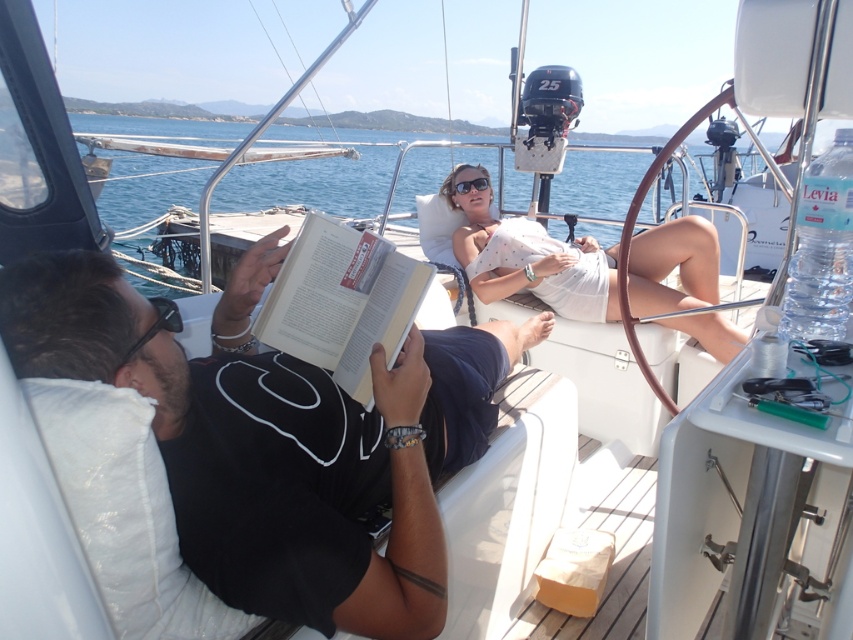
You are a passenger on the boat and want to read a book. Which object at center would you choose to hold, the black matte book at center or the white cotton dress at center, and why?

You should choose the black matte book at center because it is larger in size compared to the white cotton dress at center, making it more suitable for reading.

You are a passenger on the sailboat and want to read the black matte book at center. Where exactly should you look to find it?

The black matte book at center is located at point coordinates (279,436).

Consider the image. You are a passenger on the boat and want to place both the black matte book at center and the black plastic sunglasses at upper center on a shelf that can only hold items up to the width of the sunglasses. Can you fit both items on the shelf?

The black matte book at center might be wider than the black plastic sunglasses at upper center, so it may not fit on the shelf if the shelf can only hold items up to the width of the sunglasses.